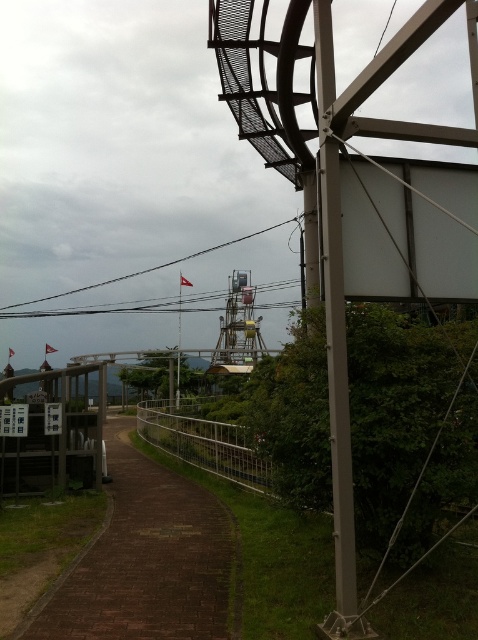
Is point (333, 84) farther from viewer compared to point (290, 221)?

No, it is in front of (290, 221).

Is point (346, 381) in front of point (128, 278)?

Yes, point (346, 381) is in front of point (128, 278).

Find the location of `metallic pole at right`. metallic pole at right is located at coordinates (335, 337).

Between brown brick path at center and black wire at center, which one has less height?

Standing shorter between the two is brown brick path at center.

Is point (144, 477) more distant than point (56, 296)?

That is False.

Find the location of `brown brick path at center`. brown brick path at center is located at coordinates (145, 560).

Does brown brick path at center have a smaller size compared to metallic pole at right?

Incorrect, brown brick path at center is not smaller in size than metallic pole at right.

Is brown brick path at center positioned behind metallic pole at right?

Yes, it is behind metallic pole at right.

Identify the location of brown brick path at center. (145, 560).